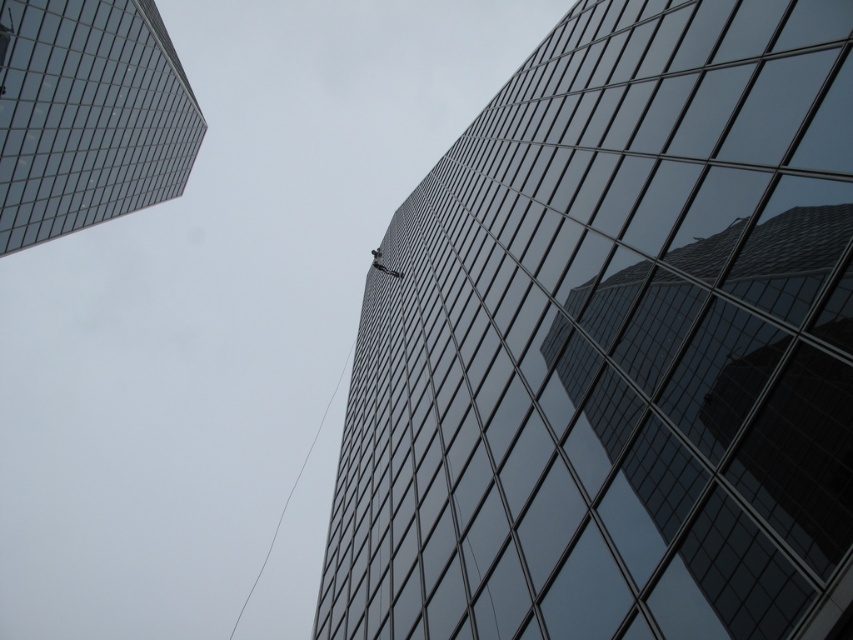
Question: In this image, where is glossy glass building at center located relative to transparent glass skyscraper at upper left?

Choices:
 (A) right
 (B) left

Answer: (A)

Question: Does glossy glass building at center lie in front of transparent glass skyscraper at upper left?

Choices:
 (A) no
 (B) yes

Answer: (B)

Question: Which object appears farthest from the camera in this image?

Choices:
 (A) transparent glass skyscraper at upper left
 (B) glossy glass building at center

Answer: (A)

Question: Is the position of glossy glass building at center more distant than that of transparent glass skyscraper at upper left?

Choices:
 (A) yes
 (B) no

Answer: (B)

Question: Which point is closer to the camera?

Choices:
 (A) glossy glass building at center
 (B) transparent glass skyscraper at upper left

Answer: (A)

Question: Which of the following is the farthest from the observer?

Choices:
 (A) (172, 177)
 (B) (529, 566)

Answer: (A)